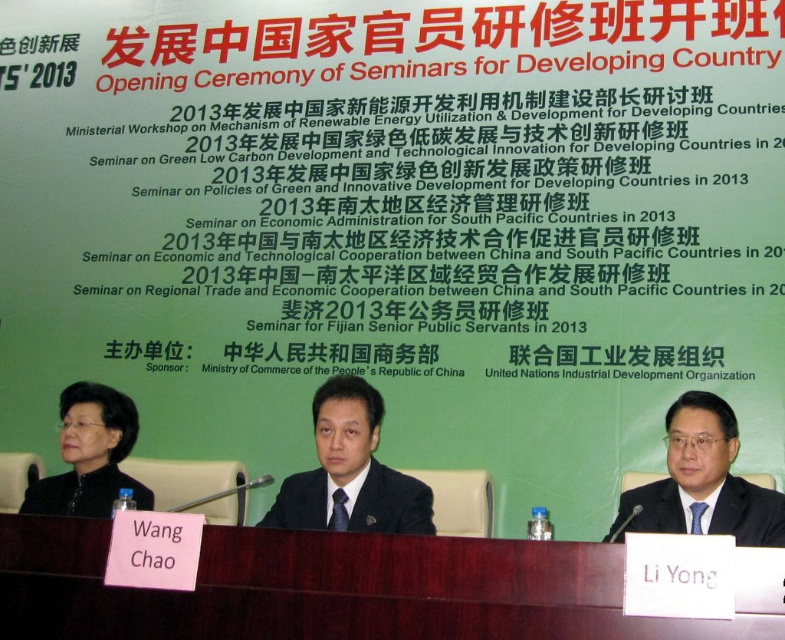
At the formal event, you notice two attendees dressed in black. One is wearing a black matte jacket at lower left and another in a black silk suit at center. Which attendee is wearing a smaller garment?

The black matte jacket at lower left is smaller than the black silk suit at center, so the attendee wearing the black matte jacket at lower left has the smaller garment.